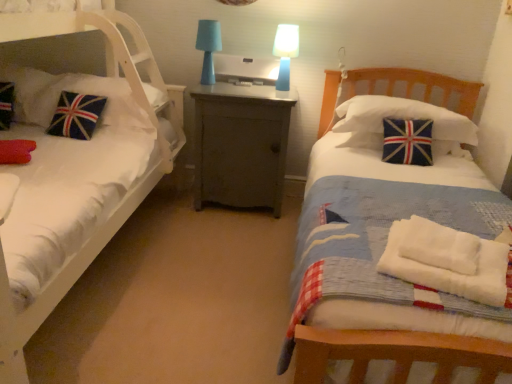
Where is `blue fabric pillow at right, the third pillow in the left-to-right sequence`? Image resolution: width=512 pixels, height=384 pixels. blue fabric pillow at right, the third pillow in the left-to-right sequence is located at coordinates (403, 118).

You are a GUI agent. You are given a task and a screenshot of the screen. Output one action in this format:
    pyautogui.click(x=<x>, y=<y>)
    Task: Click on the union jack fabric pillow at left, positioned as the 3th pillow in right-to-left order
    The image size is (512, 384).
    Given the screenshot: What is the action you would take?
    pyautogui.click(x=33, y=93)

Locate an element on the screen. white cotton towels at lower right is located at coordinates (448, 260).

In terms of height, does white fabric bed at left look taller or shorter compared to white cotton towels at lower right?

Considering their sizes, white fabric bed at left has more height than white cotton towels at lower right.

From the picture: Can you confirm if white fabric bed at left is positioned to the left of white cotton towels at lower right?

Yes, white fabric bed at left is to the left of white cotton towels at lower right.

Locate an element on the screen. Image resolution: width=512 pixels, height=384 pixels. bed that appears in front of the white cotton towels at lower right is located at coordinates (75, 169).

Who is smaller, white fabric bed at left or white cotton towels at lower right?

white cotton towels at lower right is smaller.

From the image's perspective, who appears lower, white fabric bed at left or blue plastic table lamp at upper center, marked as the first table lamp in a right-to-left arrangement?

white fabric bed at left is shown below in the image.

Is white fabric bed at left bigger than blue plastic table lamp at upper center, acting as the second table lamp starting from the left?

Indeed, white fabric bed at left has a larger size compared to blue plastic table lamp at upper center, acting as the second table lamp starting from the left.

Could you tell me if white fabric bed at left is facing blue plastic table lamp at upper center, marked as the first table lamp in a right-to-left arrangement?

No, white fabric bed at left is not aimed at blue plastic table lamp at upper center, marked as the first table lamp in a right-to-left arrangement.

From a real-world perspective, is white fabric bed at left on blue plastic table lamp at upper center, marked as the first table lamp in a right-to-left arrangement?

No, from a real-world perspective, white fabric bed at left is not above blue plastic table lamp at upper center, marked as the first table lamp in a right-to-left arrangement.

Which object is positioned more to the right, white cotton towels at lower right or union jack fabric pillow at left, the 1th pillow in the left-to-right sequence?

white cotton towels at lower right is more to the right.

Would you say white cotton towels at lower right is a long distance from union jack fabric pillow at left, the 1th pillow in the left-to-right sequence?

white cotton towels at lower right is positioned a significant distance from union jack fabric pillow at left, the 1th pillow in the left-to-right sequence.

Who is more distant, white cotton towels at lower right or union jack fabric pillow at left, positioned as the 3th pillow in right-to-left order?

union jack fabric pillow at left, positioned as the 3th pillow in right-to-left order.

Considering the points (499, 260) and (32, 73), which point is behind, point (499, 260) or point (32, 73)?

The point (32, 73) is more distant.

Between velvet union jack pillow at left, placed as the 2th pillow when sorted from right to left, and matte gray cabinet at center, which one is positioned in front?

velvet union jack pillow at left, placed as the 2th pillow when sorted from right to left.

From the image's perspective, who appears lower, velvet union jack pillow at left, which ranks as the 2th pillow in left-to-right order, or matte gray cabinet at center?

matte gray cabinet at center appears lower in the image.

Can you confirm if velvet union jack pillow at left, placed as the 2th pillow when sorted from right to left, is bigger than matte gray cabinet at center?

No.

This screenshot has width=512, height=384. In order to click on table lamp on the left of matte gray cabinet at center in this screenshot , I will do `click(208, 47)`.

Which is nearer, [210,34] or [217,117]?

Positioned in front is point [217,117].

Consider the image. Which is more to the left, blue fabric lampshade at center, which is counted as the second table lamp, starting from the right, or matte gray cabinet at center?

blue fabric lampshade at center, which is counted as the second table lamp, starting from the right.

Could you tell me if white fabric bed at left is turned towards blue fabric pillow at right, marked as the first pillow in a right-to-left arrangement?

No, white fabric bed at left is not turned towards blue fabric pillow at right, marked as the first pillow in a right-to-left arrangement.

Choose the correct answer: Is white fabric bed at left inside blue fabric pillow at right, the third pillow in the left-to-right sequence, or outside it?

white fabric bed at left is outside blue fabric pillow at right, the third pillow in the left-to-right sequence.

From the image's perspective, is white fabric bed at left located above or below blue fabric pillow at right, marked as the first pillow in a right-to-left arrangement?

white fabric bed at left is situated lower than blue fabric pillow at right, marked as the first pillow in a right-to-left arrangement, in the image.

Measure the distance from white fabric bed at left to blue fabric pillow at right, marked as the first pillow in a right-to-left arrangement.

white fabric bed at left is 4.83 feet from blue fabric pillow at right, marked as the first pillow in a right-to-left arrangement.

Can you confirm if white cotton towels at lower right is bigger than matte gray cabinet at center?

No.

What's the angular difference between white cotton towels at lower right and matte gray cabinet at center's facing directions?

21.9 degrees separate the facing orientations of white cotton towels at lower right and matte gray cabinet at center.

Can you confirm if white cotton towels at lower right is taller than matte gray cabinet at center?

No, white cotton towels at lower right is not taller than matte gray cabinet at center.

From a real-world perspective, does white cotton towels at lower right stand above matte gray cabinet at center?

Indeed, from a real-world perspective, white cotton towels at lower right stands above matte gray cabinet at center.

Find the location of a particular element. The image size is (512, 384). bed above the white cotton towels at lower right (from the image's perspective) is located at coordinates (75, 169).

You are a GUI agent. You are given a task and a screenshot of the screen. Output one action in this format:
    pyautogui.click(x=<x>, y=<y>)
    Task: Click on the bed below the blue plastic table lamp at upper center, acting as the second table lamp starting from the left (from a real-world perspective)
    The height and width of the screenshot is (384, 512).
    Given the screenshot: What is the action you would take?
    pyautogui.click(x=75, y=169)

Based on their spatial positions, is blue fabric lampshade at center, arranged as the first table lamp when viewed from the left, or white fabric bed at left further from blue plastic table lamp at upper center, marked as the first table lamp in a right-to-left arrangement?

white fabric bed at left.

When comparing their distances from blue fabric pillow at right, marked as the first pillow in a right-to-left arrangement, does velvet union jack pillow at left, placed as the 2th pillow when sorted from right to left, or white fabric bed at left seem closer?

The object closer to blue fabric pillow at right, marked as the first pillow in a right-to-left arrangement, is white fabric bed at left.

Estimate the real-world distances between objects in this image. Which object is closer to matte gray cabinet at center, velvet union jack pillow at left, which ranks as the 2th pillow in left-to-right order, or blue fabric lampshade at center, which is counted as the second table lamp, starting from the right?

Among the two, blue fabric lampshade at center, which is counted as the second table lamp, starting from the right, is located nearer to matte gray cabinet at center.

Looking at the image, which one is located further to matte gray cabinet at center, white cotton towels at lower right or union jack fabric pillow at left, positioned as the 3th pillow in right-to-left order?

white cotton towels at lower right is further to matte gray cabinet at center.

Which object lies nearer to the anchor point velvet union jack pillow at left, which ranks as the 2th pillow in left-to-right order, union jack fabric pillow at left, the 1th pillow in the left-to-right sequence, or matte gray cabinet at center?

Among the two, union jack fabric pillow at left, the 1th pillow in the left-to-right sequence, is located nearer to velvet union jack pillow at left, which ranks as the 2th pillow in left-to-right order.

Based on their spatial positions, is blue plastic table lamp at upper center, acting as the second table lamp starting from the left, or union jack fabric pillow at left, positioned as the 3th pillow in right-to-left order, further from blue fabric pillow at right, marked as the first pillow in a right-to-left arrangement?

union jack fabric pillow at left, positioned as the 3th pillow in right-to-left order, is positioned further to the anchor blue fabric pillow at right, marked as the first pillow in a right-to-left arrangement.

Considering their positions, is union jack fabric pillow at left, the 1th pillow in the left-to-right sequence, positioned closer to blue fabric lampshade at center, arranged as the first table lamp when viewed from the left, than blue fabric pillow at right, the third pillow in the left-to-right sequence?

union jack fabric pillow at left, the 1th pillow in the left-to-right sequence.

Considering their positions, is blue fabric lampshade at center, which is counted as the second table lamp, starting from the right, positioned further to white fabric bed at left than white cotton towels at lower right?

white cotton towels at lower right is further to white fabric bed at left.

The width and height of the screenshot is (512, 384). I want to click on nightstand between white fabric bed at left and blue fabric lampshade at center, arranged as the first table lamp when viewed from the left, in the front-back direction, so click(241, 145).

In order to click on table lamp situated between matte gray cabinet at center and blue fabric pillow at right, the third pillow in the left-to-right sequence, from left to right in this screenshot , I will do `click(285, 52)`.

Identify the location of nightstand between white cotton towels at lower right and blue fabric lampshade at center, which is counted as the second table lamp, starting from the right, along the z-axis. (241, 145).

At what (x,y) coordinates should I click in order to perform the action: click on pillow located between union jack fabric pillow at left, positioned as the 3th pillow in right-to-left order, and blue fabric pillow at right, the third pillow in the left-to-right sequence, in the left-right direction. Please return your answer as a coordinate pair (x, y). Looking at the image, I should click on (79, 93).